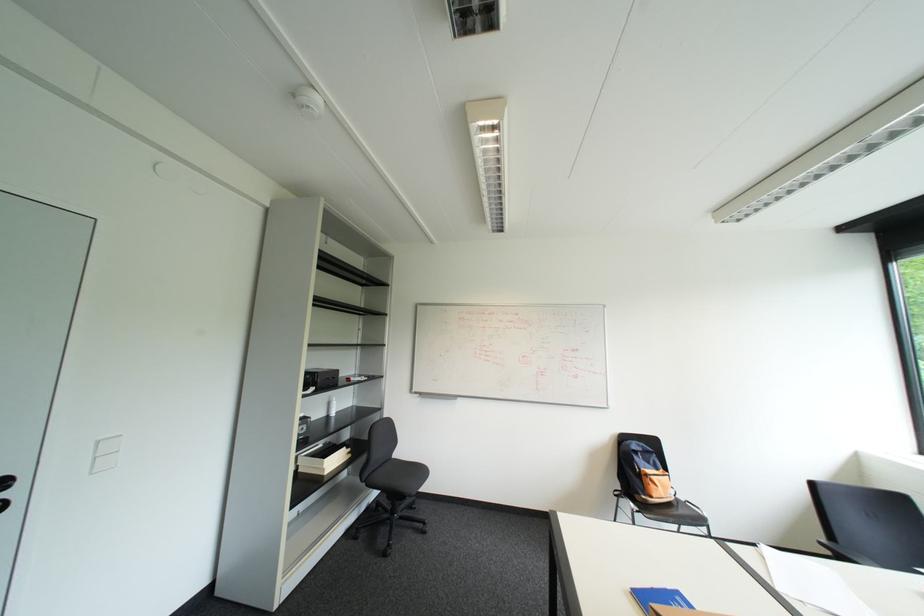
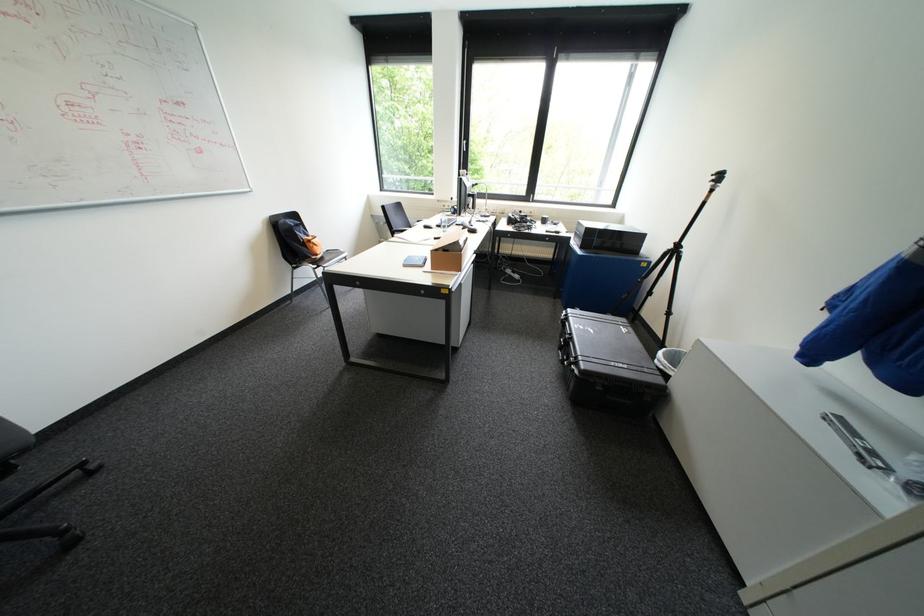
Locate, in the second image, the point that corresponds to [648,467] in the first image.

(310, 237)